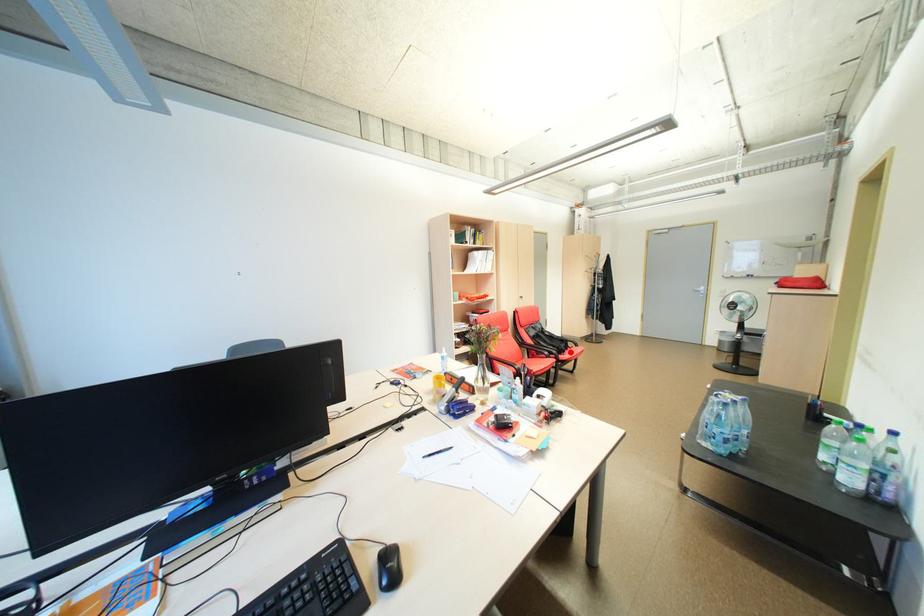
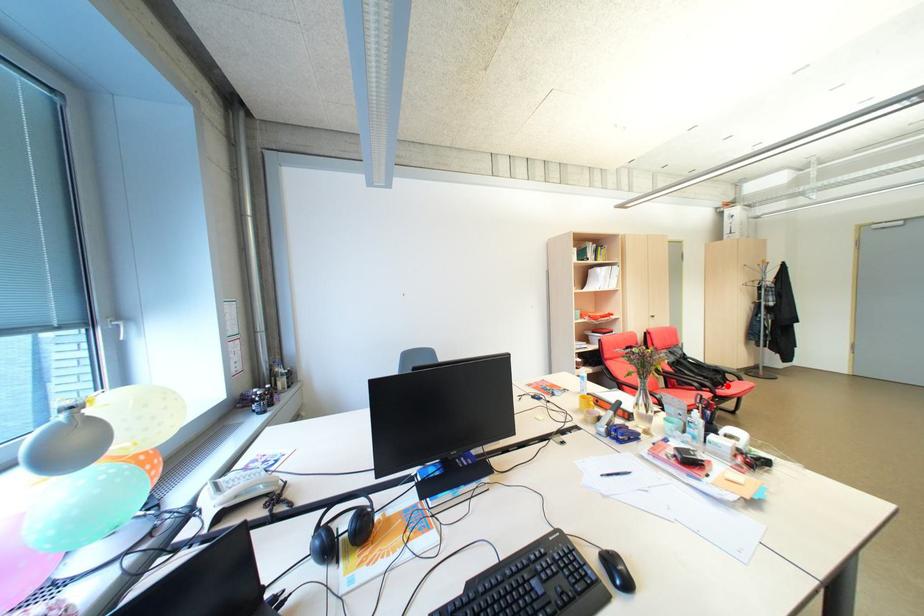
I am providing you with two images of the same scene from different viewpoints. A red point is marked on the first image and another point is marked on the second image. Is the marked point in image1 the same physical position as the marked point in image2?

Yes